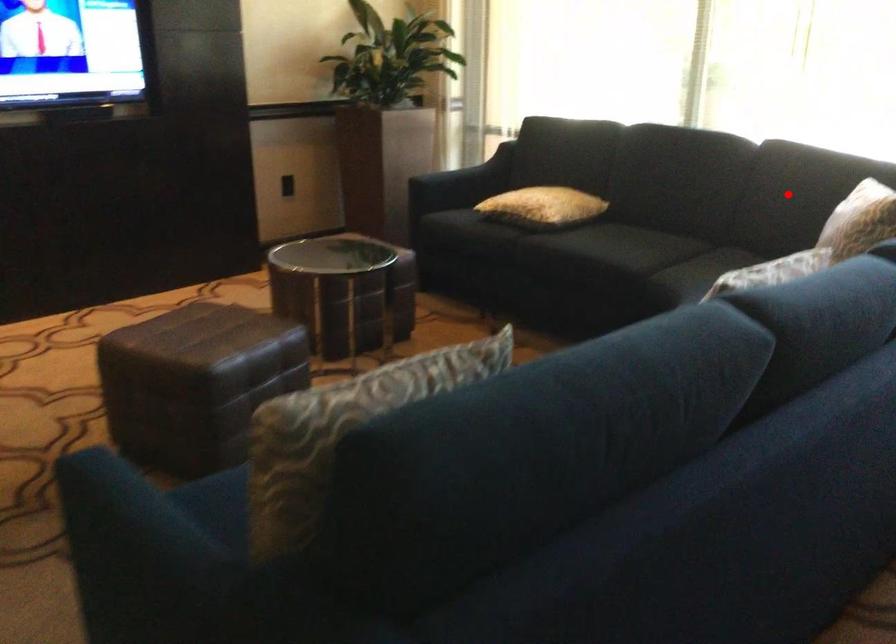
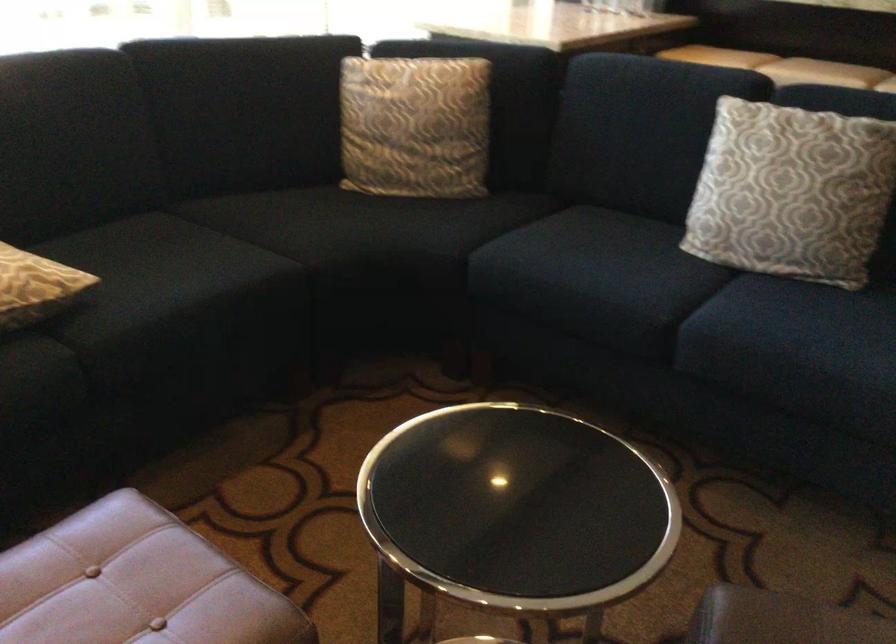
Question: I am providing you with two images of the same scene from different viewpoints. Image1 has a red point marked. In image2, the corresponding 3D location appears at what relative position? Reply with the corresponding letter.

Choices:
 (A) Closer
 (B) Farther

Answer: (A)